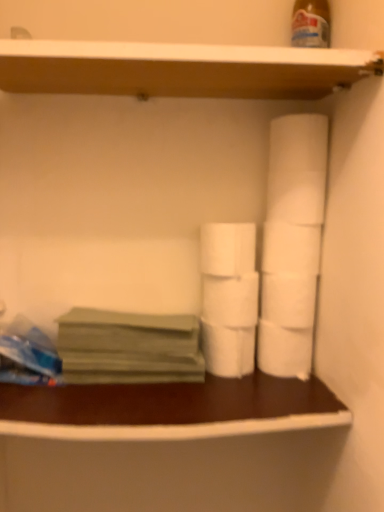
Locate an element on the screen. The image size is (384, 512). free spot above brown wood counter at lower center (from a real-world perspective) is located at coordinates (164, 386).